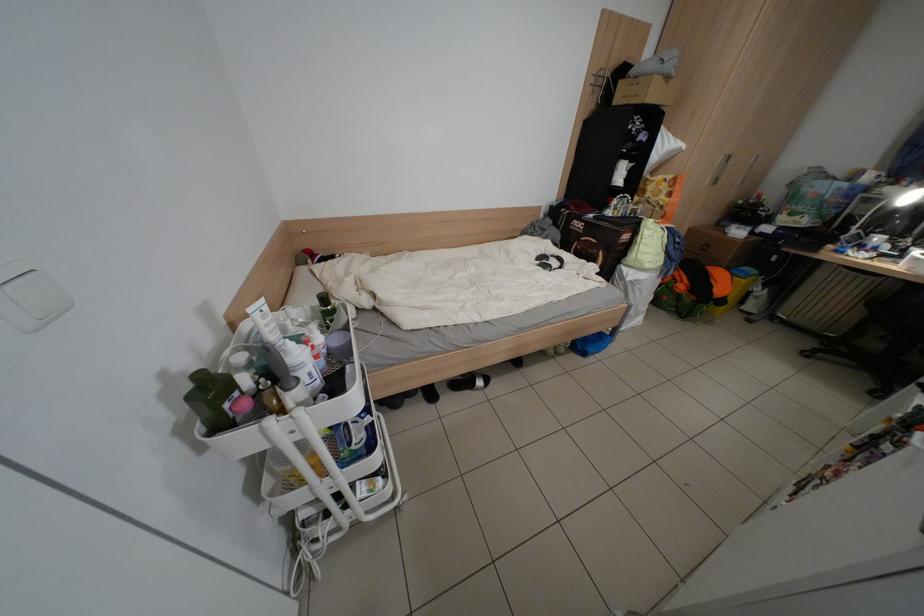
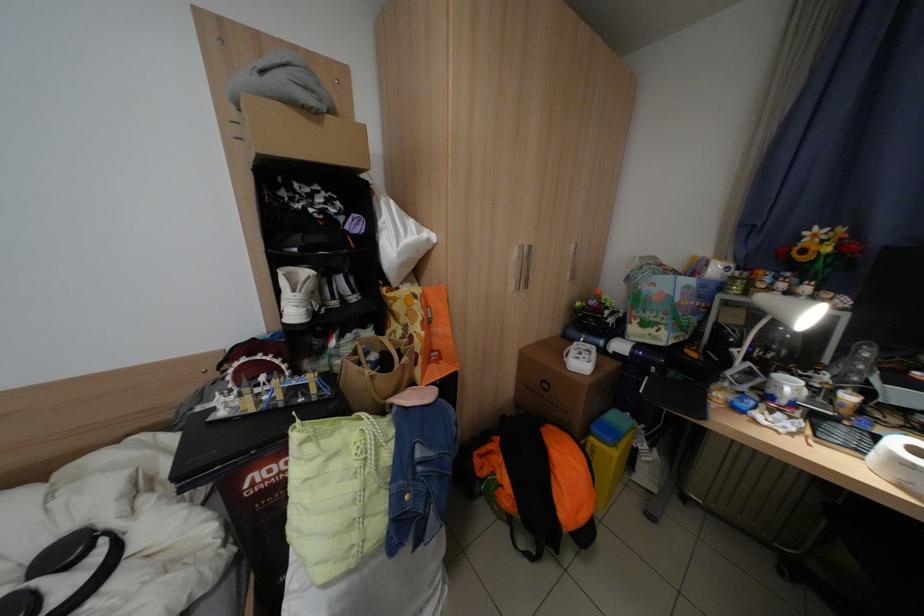
The images are taken continuously from a first-person perspective. In which direction are you moving?

The cameraman moved toward right, forward.